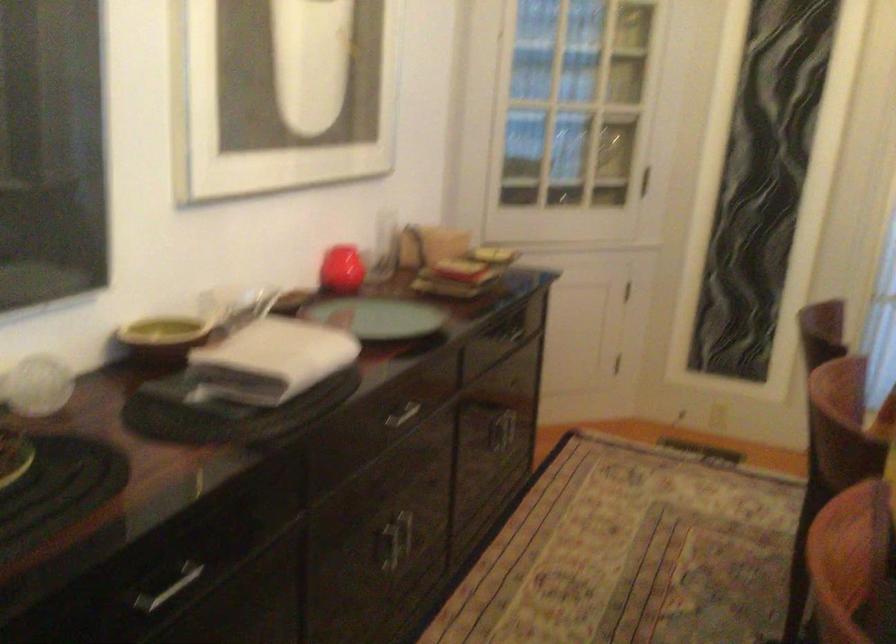
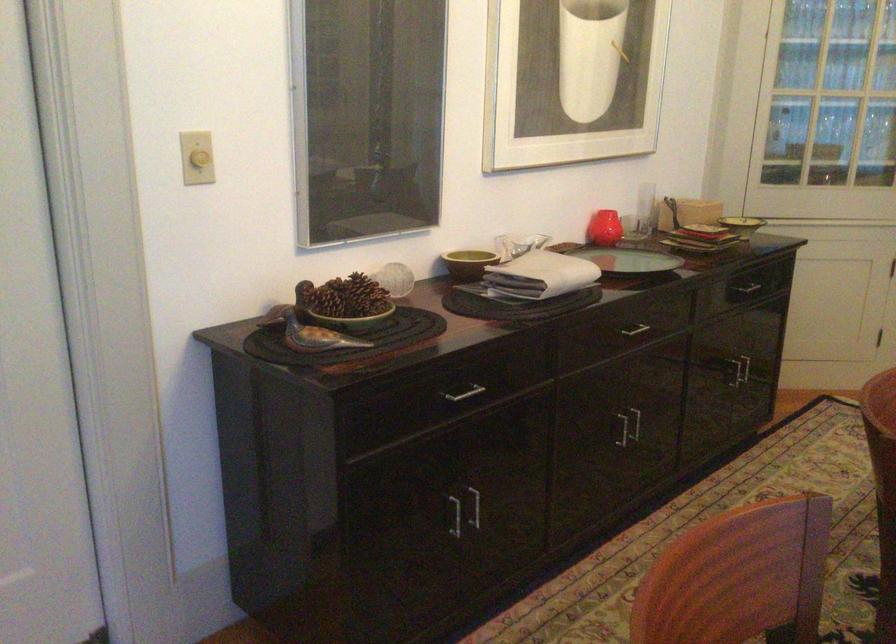
In the second image, find the point that corresponds to point (386, 540) in the first image.

(623, 429)